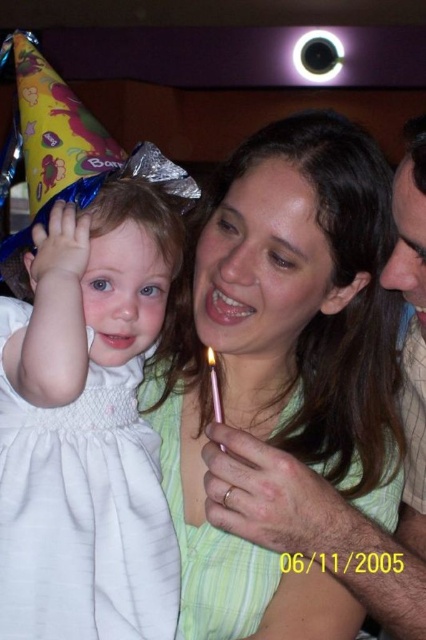
Question: Does white satin dress at left have a greater width compared to pink metallic candle at center?

Choices:
 (A) no
 (B) yes

Answer: (B)

Question: Does white satin dress at left have a larger size compared to pink metallic candle at center?

Choices:
 (A) no
 (B) yes

Answer: (B)

Question: Which of these objects is positioned farthest from the white satin dress at left?

Choices:
 (A) green striped dress at center
 (B) pink metallic candle at center

Answer: (B)

Question: Which point appears closest to the camera in this image?

Choices:
 (A) (152, 288)
 (B) (218, 400)
 (C) (296, 253)

Answer: (B)

Question: Among these points, which one is nearest to the camera?

Choices:
 (A) (317, 572)
 (B) (210, 381)

Answer: (A)

Question: Is green striped dress at center above white satin dress at left?

Choices:
 (A) no
 (B) yes

Answer: (B)